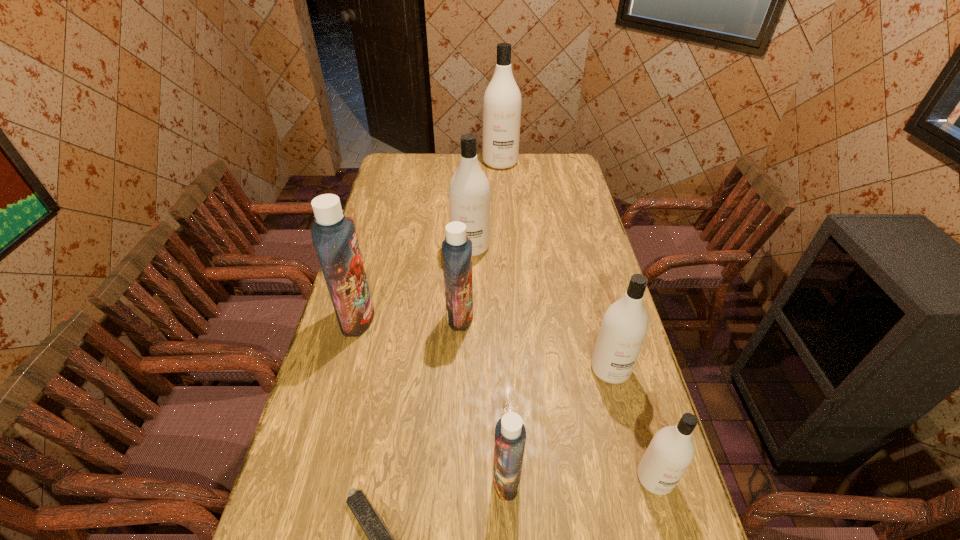
This screenshot has width=960, height=540. I want to click on the farthest shampoo, so click(502, 101).

Where is `the tallest shampoo`? The image size is (960, 540). the tallest shampoo is located at coordinates (502, 101).

Identify the location of the leftmost shampoo. This screenshot has width=960, height=540. (334, 236).

Where is `the biggest blue shampoo`? the biggest blue shampoo is located at coordinates (334, 236).

The image size is (960, 540). Identify the location of the second farthest object. (469, 191).

Identify the location of the second farthest white shampoo. (469, 191).

Where is `the second blue shampoo from left to right`? This screenshot has height=540, width=960. the second blue shampoo from left to right is located at coordinates (456, 248).

Where is `the fifth farthest object`? the fifth farthest object is located at coordinates (624, 326).

The image size is (960, 540). I want to click on the fifth farthest shampoo, so click(x=624, y=326).

I want to click on the smallest blue shampoo, so click(510, 434).